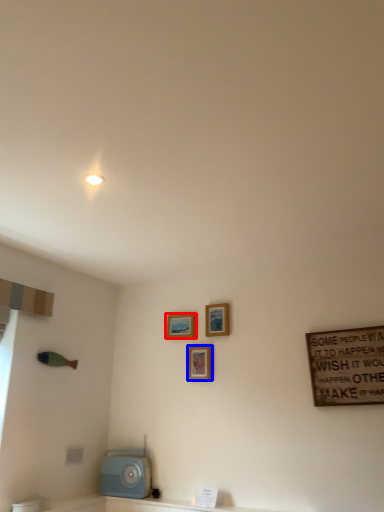
Question: Among these objects, which one is nearest to the camera, picture frame (highlighted by a red box) or picture frame (highlighted by a blue box)?

Choices:
 (A) picture frame
 (B) picture frame

Answer: (B)